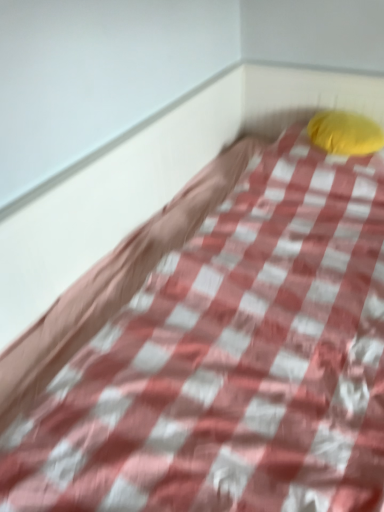
What do you see at coordinates (345, 133) in the screenshot?
I see `yellow soft pillow at upper right` at bounding box center [345, 133].

Locate an element on the screen. The height and width of the screenshot is (512, 384). yellow soft pillow at upper right is located at coordinates (345, 133).

You are a GUI agent. You are given a task and a screenshot of the screen. Output one action in this format:
    pyautogui.click(x=<x>, y=<y>)
    Task: Click on the yellow soft pillow at upper right
    Image resolution: width=384 pixels, height=512 pixels.
    Given the screenshot: What is the action you would take?
    pyautogui.click(x=345, y=133)